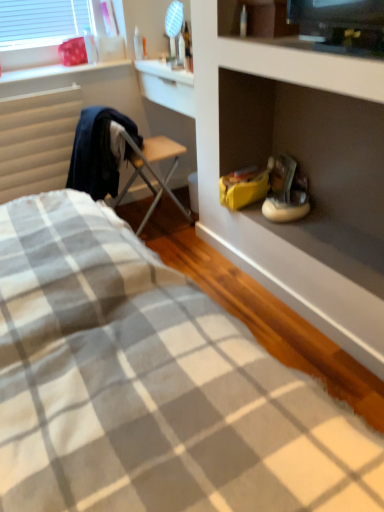
Question: In terms of width, does beige fabric radiator at left look wider or thinner when compared to white painted wood at upper left?

Choices:
 (A) wide
 (B) thin

Answer: (B)

Question: Considering the relative positions of beige fabric radiator at left and white painted wood at upper left in the image provided, is beige fabric radiator at left to the left or to the right of white painted wood at upper left?

Choices:
 (A) right
 (B) left

Answer: (B)

Question: Which of these objects is positioned farthest from the gray checkered fabric at lower left?

Choices:
 (A) beige fabric radiator at left
 (B) white painted wood at upper left
 (C) white matte sneakers at center-right
 (D) matte white cabinet at upper right
 (E) wooden folding chair at center

Answer: (B)

Question: Which of these objects is positioned closest to the gray checkered fabric at lower left?

Choices:
 (A) white painted wood at upper left
 (B) beige fabric radiator at left
 (C) wooden folding chair at center
 (D) matte white cabinet at upper right
 (E) white matte sneakers at center-right

Answer: (D)